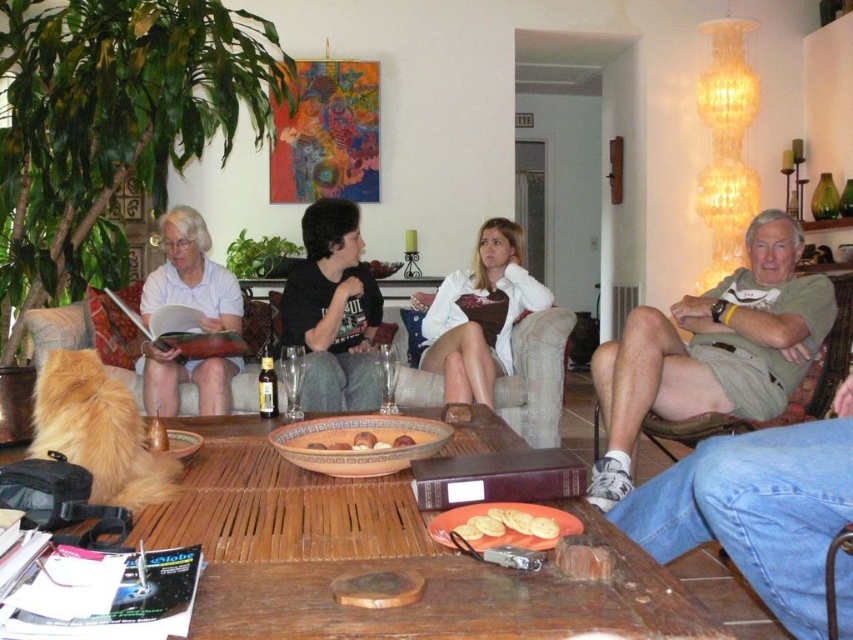
Who is more distant from viewer, (532, 609) or (778, 385)?

Point (778, 385)

Is point (334, 486) more distant than point (769, 372)?

No.

At what (x,y) coordinates should I click in order to perform the action: click on wooden table at center. Please return your answer as a coordinate pair (x, y). This screenshot has width=853, height=640. Looking at the image, I should click on (378, 557).

Can you confirm if brown fabric couch at center is thinner than golden crispy bread at center?

No.

Consider the image. Is brown fabric couch at center wider than golden crispy bread at center?

Indeed, brown fabric couch at center has a greater width compared to golden crispy bread at center.

Does point (508, 392) lie behind point (547, 524)?

Yes, it is behind point (547, 524).

The width and height of the screenshot is (853, 640). In order to click on brown fabric couch at center in this screenshot , I will do `click(537, 378)`.

Is golden crispy cookies at center in front of smooth brown cookie at center?

Yes, golden crispy cookies at center is in front of smooth brown cookie at center.

Can you confirm if golden crispy cookies at center is positioned below smooth brown cookie at center?

Indeed, golden crispy cookies at center is positioned under smooth brown cookie at center.

Between point (473, 524) and point (408, 440), which one is positioned behind?

The point (408, 440) is more distant.

Find the location of a particular element. The width and height of the screenshot is (853, 640). golden crispy cookies at center is located at coordinates (508, 524).